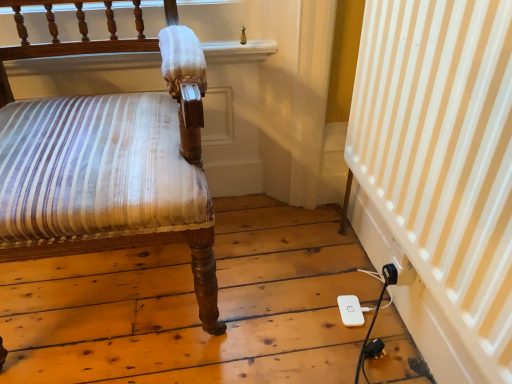
Find the location of `free area in between white plastic ipod at lower right and white striped curtain at lower right`. free area in between white plastic ipod at lower right and white striped curtain at lower right is located at coordinates (351, 324).